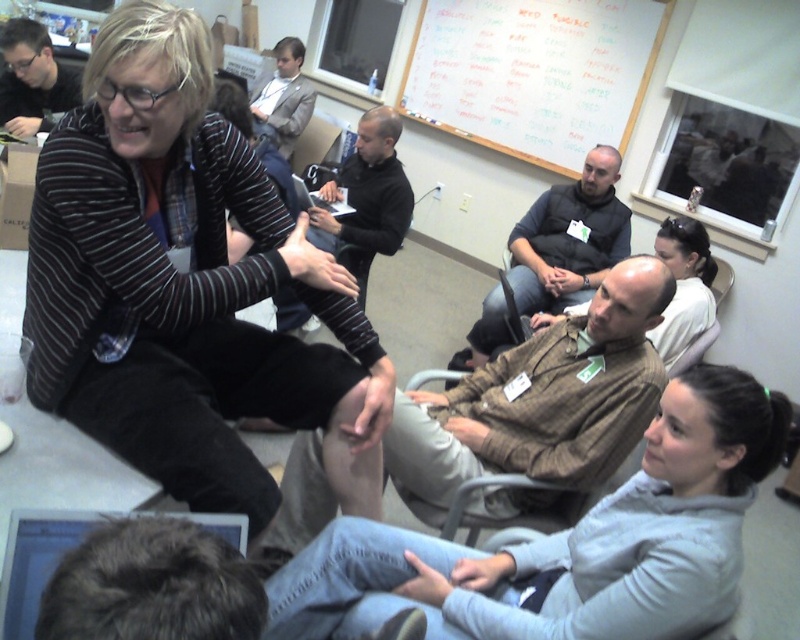
Question: Which is farther from the striped sweater at upper left?

Choices:
 (A) dark brown leather jacket at center
 (B) whiteboard at upper center

Answer: (B)

Question: Which is nearer to the silver metallic laptop at lower left?

Choices:
 (A) black smooth shirt at center
 (B) light gray fleece at lower right

Answer: (B)

Question: Is brown plaid shirt at center above matte black sweater at upper left?

Choices:
 (A) yes
 (B) no

Answer: (B)

Question: Which point appears closest to the camera in this image?

Choices:
 (A) (302, 106)
 (B) (18, 605)
 (C) (405, 74)

Answer: (B)

Question: Does light gray fleece at lower right come behind silver metallic laptop at lower left?

Choices:
 (A) no
 (B) yes

Answer: (B)

Question: Where is striped sweater at upper left located in relation to whiteboard at upper center in the image?

Choices:
 (A) below
 (B) above

Answer: (A)